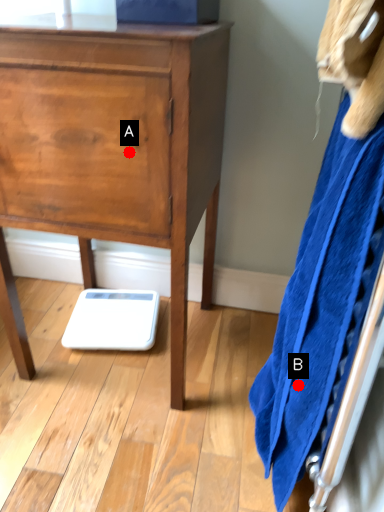
Question: Two points are circled on the image, labeled by A and B beside each circle. Among these points, which one is farthest from the camera?

Choices:
 (A) A is further
 (B) B is further

Answer: (A)